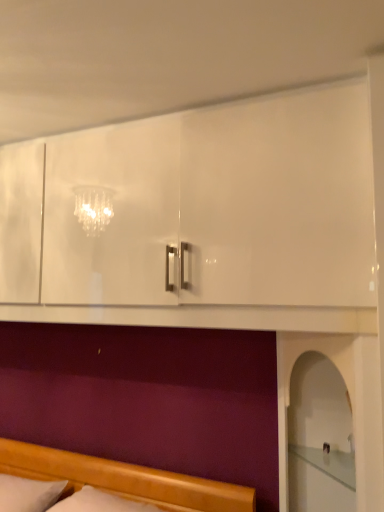
Question: Is white glossy mantle at lower center smaller than wooden bed at lower left?

Choices:
 (A) yes
 (B) no

Answer: (A)

Question: Is white glossy mantle at lower center bigger than wooden bed at lower left?

Choices:
 (A) yes
 (B) no

Answer: (B)

Question: Is white glossy mantle at lower center at the left side of wooden bed at lower left?

Choices:
 (A) no
 (B) yes

Answer: (B)

Question: Is white glossy mantle at lower center not within wooden bed at lower left?

Choices:
 (A) no
 (B) yes

Answer: (B)

Question: From the image's perspective, is white glossy mantle at lower center located beneath wooden bed at lower left?

Choices:
 (A) no
 (B) yes

Answer: (A)

Question: Could you tell me if white glossy mantle at lower center is turned towards wooden bed at lower left?

Choices:
 (A) no
 (B) yes

Answer: (A)

Question: Can you confirm if white soft pillow at lower left is positioned to the right of wooden bed at lower left?

Choices:
 (A) yes
 (B) no

Answer: (B)

Question: Can wooden bed at lower left be found inside white soft pillow at lower left?

Choices:
 (A) yes
 (B) no

Answer: (B)

Question: Are white soft pillow at lower left and wooden bed at lower left located far from each other?

Choices:
 (A) no
 (B) yes

Answer: (A)

Question: Does white soft pillow at lower left have a smaller size compared to wooden bed at lower left?

Choices:
 (A) no
 (B) yes

Answer: (B)

Question: Is white soft pillow at lower left facing away from wooden bed at lower left?

Choices:
 (A) yes
 (B) no

Answer: (B)

Question: From the image's perspective, is white soft pillow at lower left under wooden bed at lower left?

Choices:
 (A) no
 (B) yes

Answer: (B)

Question: Does wooden bed at lower left have a larger size compared to white soft pillow at lower left?

Choices:
 (A) no
 (B) yes

Answer: (B)